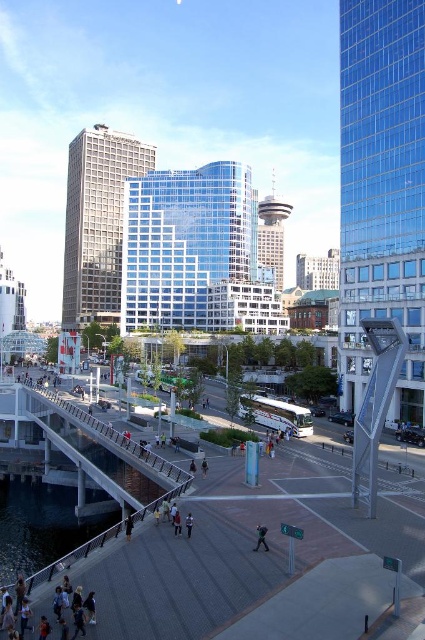
From the picture: Does transparent glass tower at right appear over concrete gray pedestrian bridge at lower left?

Indeed, transparent glass tower at right is positioned over concrete gray pedestrian bridge at lower left.

Where is `transparent glass tower at right`? The image size is (425, 640). transparent glass tower at right is located at coordinates (382, 189).

Is point (422, 307) farther from camera compared to point (25, 404)?

No, (422, 307) is closer to viewer.

Locate an element on the screen. This screenshot has height=640, width=425. transparent glass tower at right is located at coordinates (382, 189).

The image size is (425, 640). What are the coordinates of `concrete walkway at lower center` in the screenshot? It's located at (232, 545).

Where is `concrete walkway at lower center`? This screenshot has width=425, height=640. concrete walkway at lower center is located at coordinates (232, 545).

Measure the distance from matte glass building at left to clear water at lower left.

They are 114.35 meters apart.

From the picture: Between matte glass building at left and clear water at lower left, which one appears on the left side from the viewer's perspective?

matte glass building at left

At what (x,y) coordinates should I click in order to perform the action: click on matte glass building at left. Please return your answer as a coordinate pair (x, y). This screenshot has width=425, height=640. Looking at the image, I should click on (96, 221).

This screenshot has width=425, height=640. Identify the location of matte glass building at left. (96, 221).